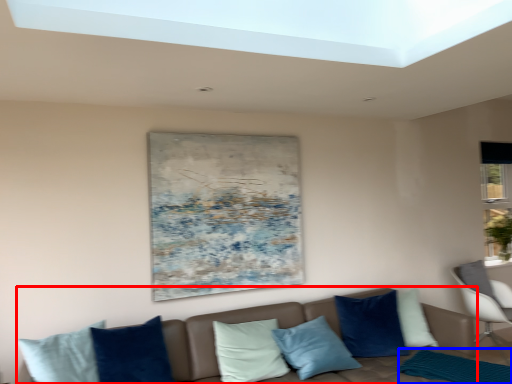
Question: Which object appears closest to the camera in this image, studio couch (highlighted by a red box) or mat (highlighted by a blue box)?

Choices:
 (A) studio couch
 (B) mat

Answer: (A)